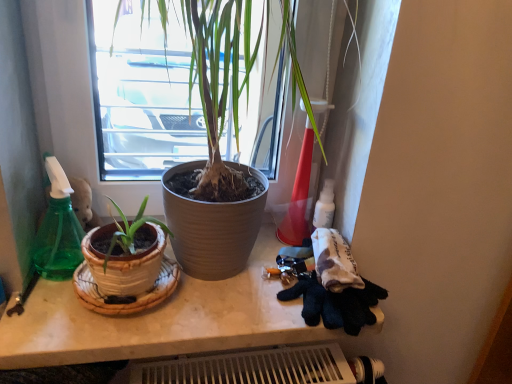
Question: Is white marble counter at center shorter than green plastic spray bottle at left?

Choices:
 (A) no
 (B) yes

Answer: (B)

Question: Does white marble counter at center have a larger size compared to green plastic spray bottle at left?

Choices:
 (A) yes
 (B) no

Answer: (A)

Question: Does white marble counter at center have a smaller size compared to green plastic spray bottle at left?

Choices:
 (A) yes
 (B) no

Answer: (B)

Question: Is white marble counter at center directly adjacent to green plastic spray bottle at left?

Choices:
 (A) no
 (B) yes

Answer: (A)

Question: Considering the relative sizes of white marble counter at center and green plastic spray bottle at left in the image provided, is white marble counter at center taller than green plastic spray bottle at left?

Choices:
 (A) yes
 (B) no

Answer: (B)

Question: From the image's perspective, is white marble counter at center beneath green plastic spray bottle at left?

Choices:
 (A) yes
 (B) no

Answer: (A)

Question: Is green plastic spray bottle at left oriented away from white marble counter at center?

Choices:
 (A) yes
 (B) no

Answer: (B)

Question: Considering the relative sizes of green plastic spray bottle at left and white marble counter at center in the image provided, is green plastic spray bottle at left thinner than white marble counter at center?

Choices:
 (A) yes
 (B) no

Answer: (A)

Question: Is the position of green plastic spray bottle at left more distant than that of white marble counter at center?

Choices:
 (A) no
 (B) yes

Answer: (B)

Question: Is green plastic spray bottle at left closer to camera compared to white marble counter at center?

Choices:
 (A) yes
 (B) no

Answer: (B)

Question: Does green plastic spray bottle at left have a greater height compared to white marble counter at center?

Choices:
 (A) yes
 (B) no

Answer: (A)

Question: Is green plastic spray bottle at left positioned beyond the bounds of white marble counter at center?

Choices:
 (A) no
 (B) yes

Answer: (B)

Question: From the image's perspective, is white marble counter at center above or below green plastic spray bottle at left?

Choices:
 (A) above
 (B) below

Answer: (B)